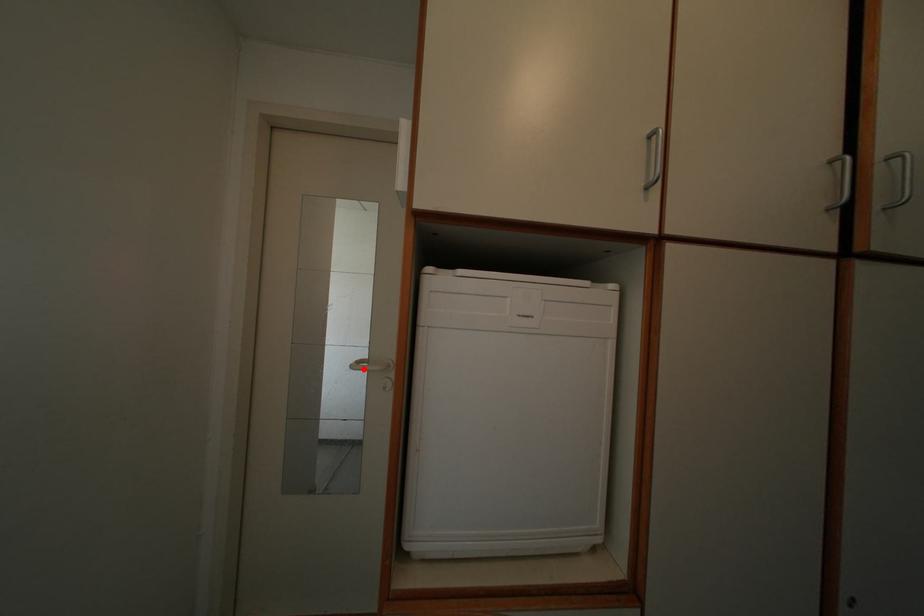
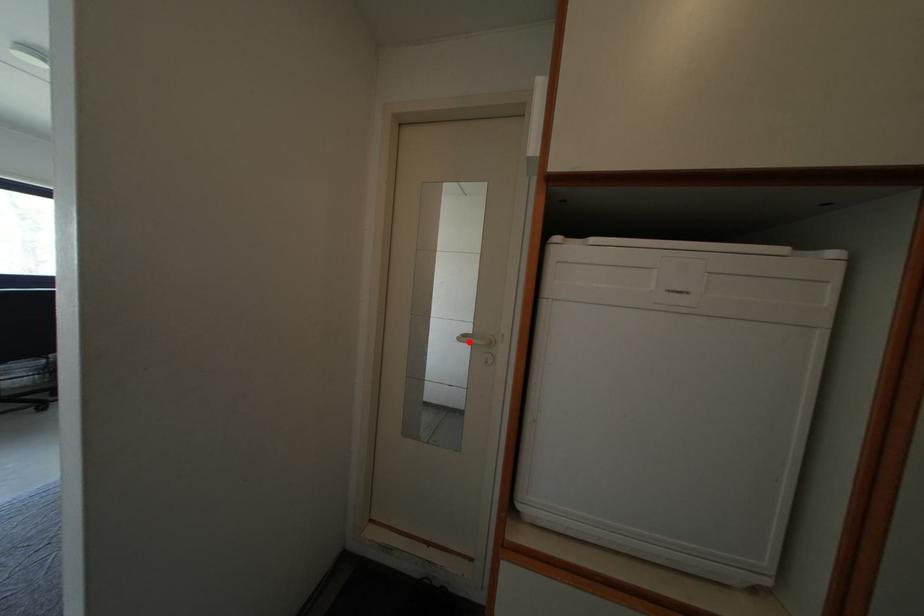
I am providing you with two images of the same scene from different viewpoints. A red point is marked on the first image and another point is marked on the second image. Is the red point in image1 aligned with the point shown in image2?

Yes